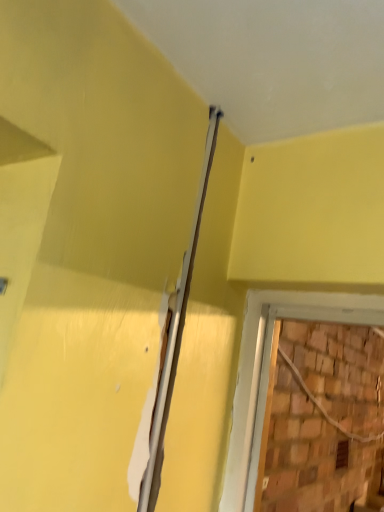
What do you see at coordinates (175, 337) in the screenshot? The height and width of the screenshot is (512, 384). I see `white glossy beam at upper center` at bounding box center [175, 337].

This screenshot has height=512, width=384. What are the coordinates of `white glossy beam at upper center` in the screenshot? It's located at (175, 337).

At what (x,y) coordinates should I click in order to perform the action: click on brown wooden hole at lower right. Please return your answer as a coordinate pair (x, y). The height and width of the screenshot is (512, 384). Looking at the image, I should click on (342, 454).

This screenshot has width=384, height=512. Describe the element at coordinates (342, 454) in the screenshot. I see `brown wooden hole at lower right` at that location.

Find the location of a particular element. This screenshot has height=512, width=384. white glossy beam at upper center is located at coordinates (x=175, y=337).

Visually, is white glossy beam at upper center positioned to the left or to the right of brown wooden hole at lower right?

Clearly, white glossy beam at upper center is on the left of brown wooden hole at lower right in the image.

Is white glossy beam at upper center in front of or behind brown wooden hole at lower right in the image?

Clearly, white glossy beam at upper center is in front of brown wooden hole at lower right.

Does point (160, 474) lie in front of point (343, 441)?

Yes, point (160, 474) is in front of point (343, 441).

From the image's perspective, which is below, white glossy beam at upper center or brown wooden hole at lower right?

brown wooden hole at lower right, from the image's perspective.

From a real-world perspective, which is physically below, white glossy beam at upper center or brown wooden hole at lower right?

brown wooden hole at lower right.

In the scene shown: Considering the sizes of objects white glossy beam at upper center and brown wooden hole at lower right in the image provided, who is wider, white glossy beam at upper center or brown wooden hole at lower right?

brown wooden hole at lower right is wider.

Is white glossy beam at upper center shorter than brown wooden hole at lower right?

Incorrect, the height of white glossy beam at upper center does not fall short of that of brown wooden hole at lower right.

Does white glossy beam at upper center have a larger size compared to brown wooden hole at lower right?

No.

Based on the photo, would you say white glossy beam at upper center contains brown wooden hole at lower right?

No, brown wooden hole at lower right is not surrounded by white glossy beam at upper center.

Is white glossy beam at upper center far away from brown wooden hole at lower right?

Indeed, white glossy beam at upper center is not near brown wooden hole at lower right.

Is white glossy beam at upper center positioned with its back to brown wooden hole at lower right?

No, brown wooden hole at lower right is not at the back of white glossy beam at upper center.

The height and width of the screenshot is (512, 384). I want to click on beam that appears above the brown wooden hole at lower right (from the image's perspective), so click(175, 337).

Considering the positions of objects brown wooden hole at lower right and white glossy beam at upper center in the image provided, who is more to the left, brown wooden hole at lower right or white glossy beam at upper center?

From the viewer's perspective, white glossy beam at upper center appears more on the left side.

Is brown wooden hole at lower right in front of or behind white glossy beam at upper center in the image?

Clearly, brown wooden hole at lower right is behind white glossy beam at upper center.

Does point (341, 444) appear closer or farther from the camera than point (157, 390)?

Point (341, 444) appears to be farther away from the viewer than point (157, 390).

From the image's perspective, between brown wooden hole at lower right and white glossy beam at upper center, who is located below?

brown wooden hole at lower right.

From a real-world perspective, is brown wooden hole at lower right positioned under white glossy beam at upper center based on gravity?

Yes, from a real-world perspective, brown wooden hole at lower right is under white glossy beam at upper center.

Which of these two, brown wooden hole at lower right or white glossy beam at upper center, is thinner?

white glossy beam at upper center.

From the picture: Can you confirm if brown wooden hole at lower right is shorter than white glossy beam at upper center?

Indeed, brown wooden hole at lower right has a lesser height compared to white glossy beam at upper center.

Who is smaller, brown wooden hole at lower right or white glossy beam at upper center?

With smaller size is white glossy beam at upper center.

Could white glossy beam at upper center be considered to be inside brown wooden hole at lower right?

No, white glossy beam at upper center is located outside of brown wooden hole at lower right.

Is brown wooden hole at lower right touching white glossy beam at upper center?

A: They are not placed beside each other.

Is brown wooden hole at lower right oriented towards white glossy beam at upper center?

No, brown wooden hole at lower right is not facing towards white glossy beam at upper center.

How different are the orientations of brown wooden hole at lower right and white glossy beam at upper center in degrees?

There is a 0.536-degree angle between the facing directions of brown wooden hole at lower right and white glossy beam at upper center.

Where is `beam that is on the left side of brown wooden hole at lower right`? The image size is (384, 512). beam that is on the left side of brown wooden hole at lower right is located at coordinates (175, 337).

Where is `beam above the brown wooden hole at lower right (from the image's perspective)`? The image size is (384, 512). beam above the brown wooden hole at lower right (from the image's perspective) is located at coordinates (175, 337).

This screenshot has height=512, width=384. Identify the location of beam located on the left of brown wooden hole at lower right. (175, 337).